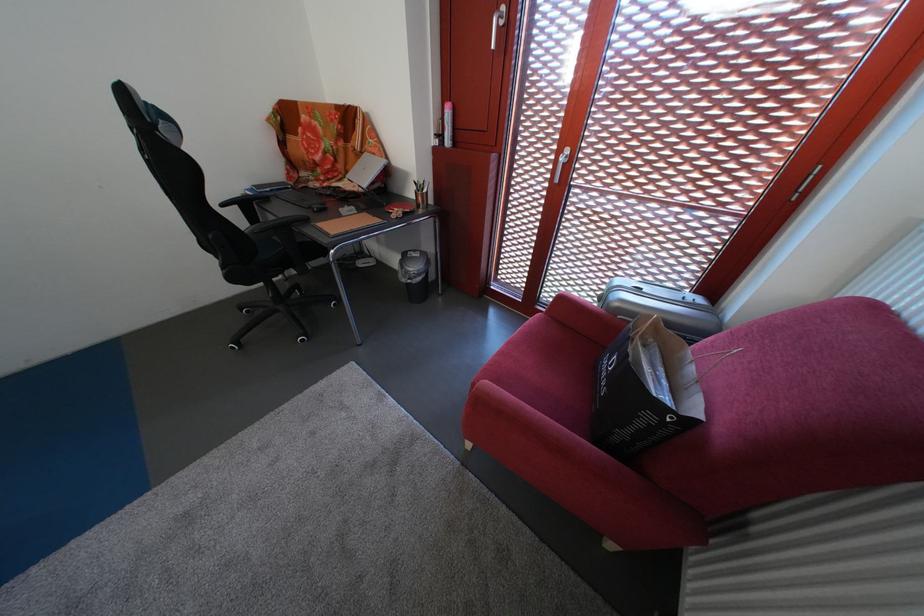
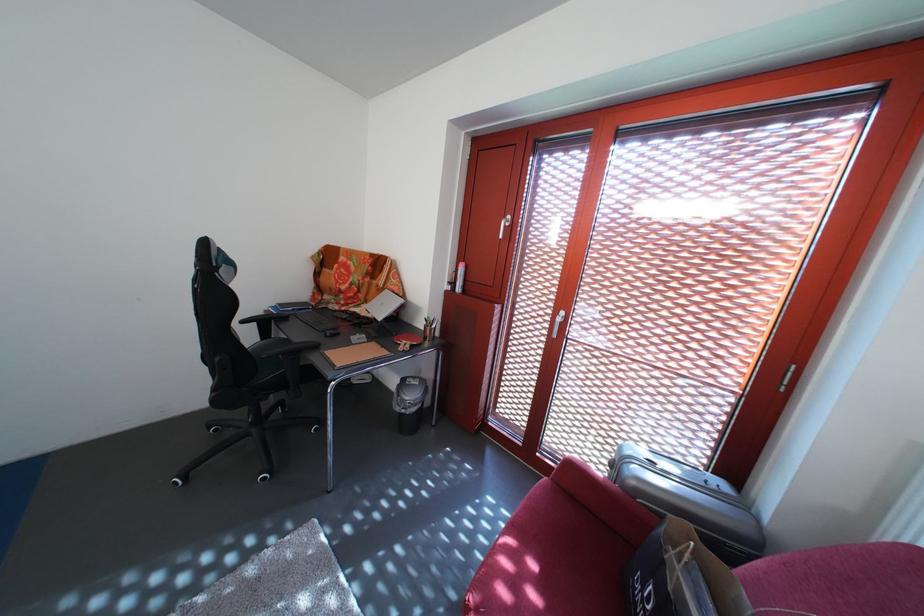
Find the pixel in the second image that matches point 560,182 in the first image.

(556, 331)